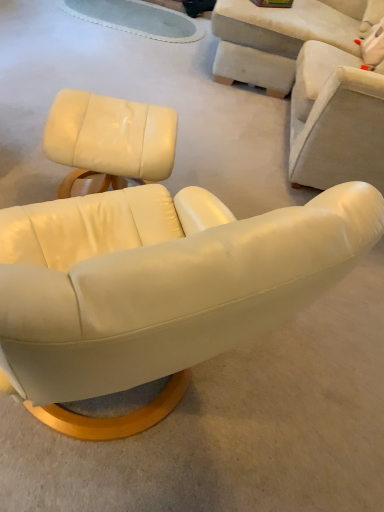
Question: Is matte white leather ottoman at upper left, placed as the first chair when sorted from left to right, positioned in front of matte white armchair at upper right, the 3th chair viewed from the left?

Choices:
 (A) yes
 (B) no

Answer: (A)

Question: Can matte white armchair at upper right, the 3th chair viewed from the left, be found inside matte white leather ottoman at upper left, placed as the first chair when sorted from left to right?

Choices:
 (A) no
 (B) yes

Answer: (A)

Question: Is matte white leather ottoman at upper left, placed as the first chair when sorted from left to right, smaller than matte white armchair at upper right, the 3th chair viewed from the left?

Choices:
 (A) yes
 (B) no

Answer: (A)

Question: Is matte white leather ottoman at upper left, placed as the first chair when sorted from left to right, wider than matte white armchair at upper right, the 3th chair viewed from the left?

Choices:
 (A) no
 (B) yes

Answer: (B)

Question: Does matte white leather ottoman at upper left, the 3th chair positioned from the right, turn towards matte white armchair at upper right, which appears as the first chair when viewed from the right?

Choices:
 (A) no
 (B) yes

Answer: (A)

Question: Which is correct: matte white armchair at upper right, the 3th chair viewed from the left, is inside matte white leather chair at center, the second chair in the left-to-right sequence, or outside of it?

Choices:
 (A) inside
 (B) outside

Answer: (B)

Question: Considering the positions of point (324, 48) and point (69, 313), is point (324, 48) closer or farther from the camera than point (69, 313)?

Choices:
 (A) closer
 (B) farther

Answer: (B)

Question: Considering their positions, is matte white armchair at upper right, the 3th chair viewed from the left, located in front of or behind matte white leather chair at center, the second chair viewed from the right?

Choices:
 (A) behind
 (B) front

Answer: (A)

Question: Would you say matte white armchair at upper right, the 3th chair viewed from the left, is to the left or to the right of matte white leather chair at center, the second chair viewed from the right, in the picture?

Choices:
 (A) left
 (B) right

Answer: (B)

Question: Is matte white leather ottoman at upper left, the 3th chair positioned from the right, wider or thinner than matte white armchair at upper right, the 3th chair viewed from the left?

Choices:
 (A) wide
 (B) thin

Answer: (A)

Question: Is point (62, 150) closer or farther from the camera than point (354, 74)?

Choices:
 (A) farther
 (B) closer

Answer: (B)

Question: From the image's perspective, is matte white leather ottoman at upper left, placed as the first chair when sorted from left to right, located above or below matte white armchair at upper right, which appears as the first chair when viewed from the right?

Choices:
 (A) below
 (B) above

Answer: (A)

Question: Considering the positions of matte white leather ottoman at upper left, placed as the first chair when sorted from left to right, and matte white armchair at upper right, which appears as the first chair when viewed from the right, in the image, is matte white leather ottoman at upper left, placed as the first chair when sorted from left to right, bigger or smaller than matte white armchair at upper right, which appears as the first chair when viewed from the right,?

Choices:
 (A) small
 (B) big

Answer: (A)

Question: Considering the positions of matte white leather chair at center, the second chair in the left-to-right sequence, and matte white leather ottoman at upper left, placed as the first chair when sorted from left to right, in the image, is matte white leather chair at center, the second chair in the left-to-right sequence, taller or shorter than matte white leather ottoman at upper left, placed as the first chair when sorted from left to right,?

Choices:
 (A) short
 (B) tall

Answer: (A)

Question: Does point (369, 224) appear closer or farther from the camera than point (142, 177)?

Choices:
 (A) closer
 (B) farther

Answer: (A)